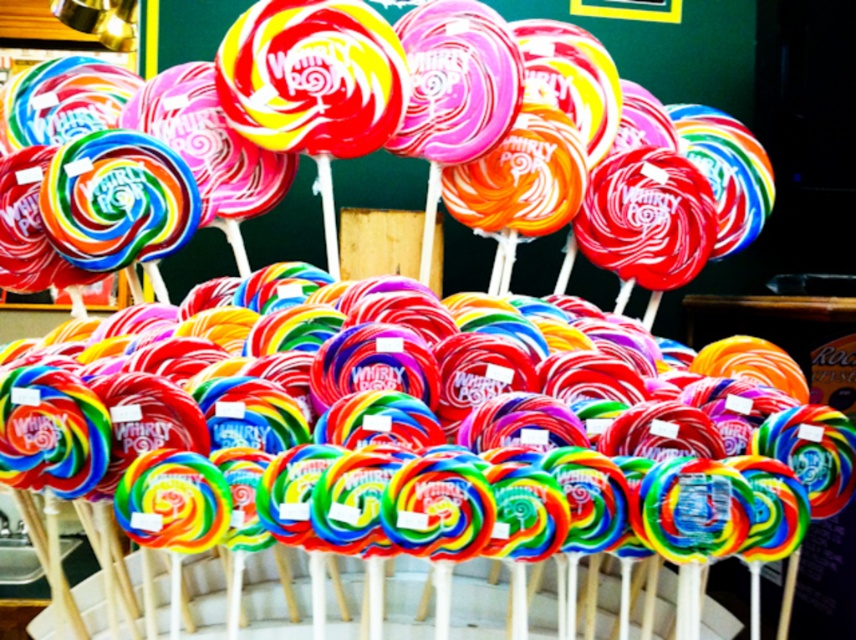
Which lollipop has a smaller width between the rainbow swirl lollipop at center and the swirled candy at center?

The rainbow swirl lollipop at center has a smaller width compared to the swirled candy at center.

You are a store employee who needs to ensure all lollipops are displayed properly. According to the image, which lollipop is taller between the rainbow swirl lollipop at center and the swirled candy at center?

The rainbow swirl lollipop at center is taller than the swirled candy at center.

You are standing in front of the Whirly Pop lollipop display. There are two points marked in the image. The first point is at coordinates point (658, 403) and the second point is at point (550, 248). Which point is closer to you?

Point (658, 403) is closer to the camera than point (550, 248).